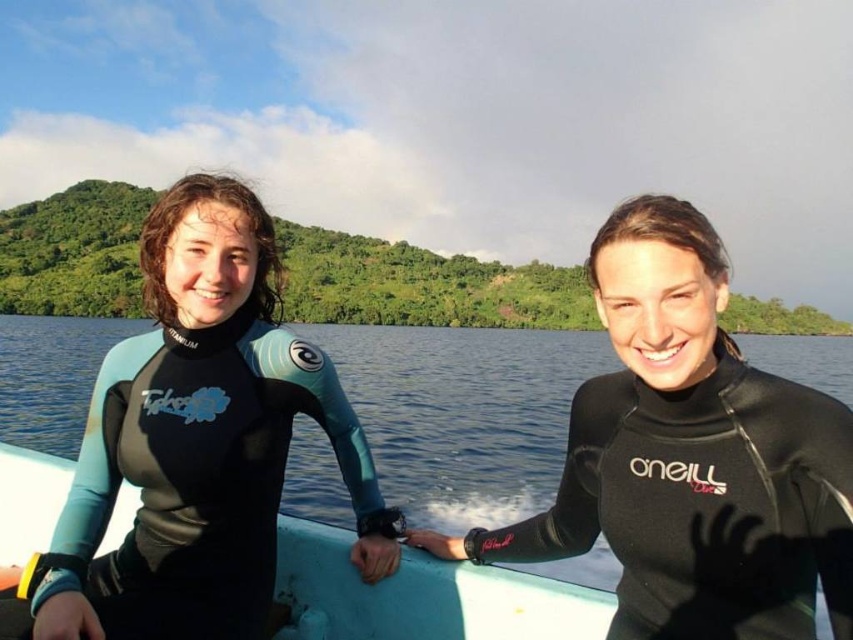
Which is in front, point (682, 525) or point (357, 628)?

Positioned in front is point (682, 525).

Does point (850, 456) lie in front of point (3, 486)?

Yes, it is in front of point (3, 486).

Does point (708, 438) come in front of point (577, 602)?

Yes.

Find the location of `black matte wetsuit at center`. black matte wetsuit at center is located at coordinates (703, 506).

Who is lower down, teal matte wetsuit at left or black matte wetsuit at center?

black matte wetsuit at center is lower down.

Does point (149, 252) lie in front of point (647, 497)?

No, (149, 252) is further to viewer.

Identify the location of teal matte wetsuit at left. (198, 442).

Between point (256, 387) and point (583, 602), which one is positioned behind?

Positioned behind is point (256, 387).

You are a GUI agent. You are given a task and a screenshot of the screen. Output one action in this format:
    pyautogui.click(x=<x>, y=<y>)
    Task: Click on the teal matte wetsuit at left
    The width and height of the screenshot is (853, 640).
    Given the screenshot: What is the action you would take?
    pyautogui.click(x=198, y=442)